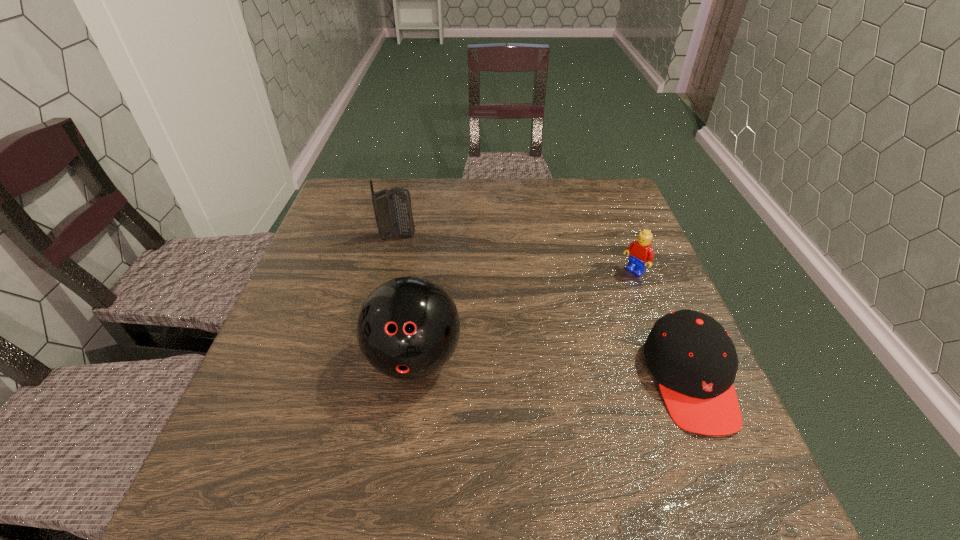
Find the location of a particular element. The image size is (960, 540). vacant space on the desktop that is between the bowling ball and the cap and is positioned on the keyboard of the farthest object is located at coordinates (559, 370).

I want to click on free space on the desktop that is between the bowling ball and the cap and is positioned on the front-facing side of the third nearest object, so click(x=509, y=367).